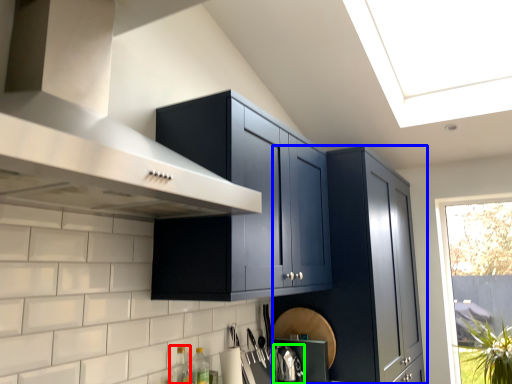
Question: Considering the real-world distances, which object is farthest from bottle (highlighted by a red box)? cabinetry (highlighted by a blue box) or appliance (highlighted by a green box)?

Choices:
 (A) cabinetry
 (B) appliance

Answer: (A)